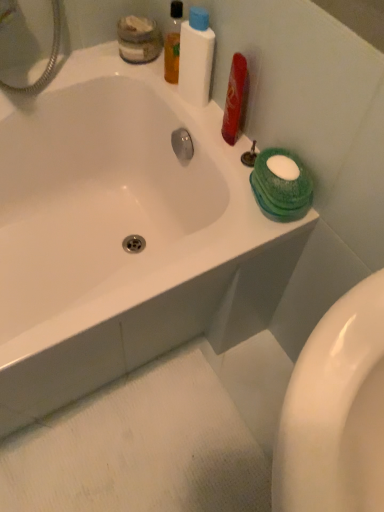
Describe the element at coordinates (138, 39) in the screenshot. Image resolution: width=384 pixels, height=512 pixels. I see `matte glass jar at upper left` at that location.

Locate an element on the screen. white glossy bathtub at upper center is located at coordinates (123, 234).

Find the location of a particular element. Image resolution: width=384 pixels, height=512 pixels. translucent plastic mouthwash at upper center is located at coordinates (173, 42).

Which object is closer to the camera taking this photo, translucent plastic mouthwash at upper center or matte glass jar at upper left?

Positioned in front is translucent plastic mouthwash at upper center.

Is translucent plastic mouthwash at upper center wider or thinner than matte glass jar at upper left?

Clearly, translucent plastic mouthwash at upper center has less width compared to matte glass jar at upper left.

Do you think translucent plastic mouthwash at upper center is within matte glass jar at upper left, or outside of it?

translucent plastic mouthwash at upper center is outside matte glass jar at upper left.

Who is smaller, translucent plastic mouthwash at upper center or matte glass jar at upper left?

translucent plastic mouthwash at upper center is smaller.

Who is taller, white glossy bathtub at upper center or translucent plastic mouthwash at upper center?

With more height is white glossy bathtub at upper center.

Is white glossy bathtub at upper center inside the boundaries of translucent plastic mouthwash at upper center, or outside?

white glossy bathtub at upper center lies outside translucent plastic mouthwash at upper center.

From a real-world perspective, which is physically below, white glossy bathtub at upper center or translucent plastic mouthwash at upper center?

white glossy bathtub at upper center is physically lower.

You are a GUI agent. You are given a task and a screenshot of the screen. Output one action in this format:
    pyautogui.click(x=<x>, y=<y>)
    Task: Click on the mouthwash behind the white glossy bathtub at upper center
    The height and width of the screenshot is (512, 384).
    Given the screenshot: What is the action you would take?
    pyautogui.click(x=173, y=42)

Is matte glass jar at upper left oriented towards white plastic bottle at upper center?

No, matte glass jar at upper left is not oriented towards white plastic bottle at upper center.

Based on the photo, how different are the orientations of matte glass jar at upper left and white plastic bottle at upper center in degrees?

The facing directions of matte glass jar at upper left and white plastic bottle at upper center are 0.000153 degrees apart.

From a real-world perspective, is matte glass jar at upper left located higher than white plastic bottle at upper center?

No, from a real-world perspective, matte glass jar at upper left is not above white plastic bottle at upper center.

From a real-world perspective, between white plastic bottle at upper center and matte glass jar at upper left, who is vertically higher?

In real-world perspective, white plastic bottle at upper center is above.

Is white plastic bottle at upper center next to matte glass jar at upper left?

No, white plastic bottle at upper center is not in contact with matte glass jar at upper left.

The height and width of the screenshot is (512, 384). In order to click on toiletry above the white plastic bottle at upper center (from the image's perspective) in this screenshot , I will do `click(138, 39)`.

Which is correct: white plastic bottle at upper center is inside matte glass jar at upper left, or outside of it?

white plastic bottle at upper center is spatially situated outside matte glass jar at upper left.

From a real-world perspective, is translucent plastic mouthwash at upper center on white plastic bottle at upper center?

Incorrect, from a real-world perspective, translucent plastic mouthwash at upper center is lower than white plastic bottle at upper center.

Is translucent plastic mouthwash at upper center beside white plastic bottle at upper center?

Yes, translucent plastic mouthwash at upper center is beside white plastic bottle at upper center.

Is the depth of translucent plastic mouthwash at upper center less than that of white plastic bottle at upper center?

No, translucent plastic mouthwash at upper center is further to the viewer.

Considering the sizes of objects translucent plastic mouthwash at upper center and white plastic bottle at upper center in the image provided, who is thinner, translucent plastic mouthwash at upper center or white plastic bottle at upper center?

With smaller width is translucent plastic mouthwash at upper center.

Where is `toiletry below the translucent plastic mouthwash at upper center (from a real-world perspective)`? This screenshot has width=384, height=512. toiletry below the translucent plastic mouthwash at upper center (from a real-world perspective) is located at coordinates point(138,39).

From the image's perspective, which object appears higher, matte glass jar at upper left or translucent plastic mouthwash at upper center?

matte glass jar at upper left appears higher in the image.

From a real-world perspective, is matte glass jar at upper left physically below translucent plastic mouthwash at upper center?

Indeed, from a real-world perspective, matte glass jar at upper left is positioned beneath translucent plastic mouthwash at upper center.

Which is correct: matte glass jar at upper left is inside translucent plastic mouthwash at upper center, or outside of it?

matte glass jar at upper left is spatially situated outside translucent plastic mouthwash at upper center.

Which of these two, matte glass jar at upper left or white glossy bathtub at upper center, is thinner?

matte glass jar at upper left.

From a real-world perspective, is matte glass jar at upper left above or below white glossy bathtub at upper center?

In terms of real-world spatial position, matte glass jar at upper left is above white glossy bathtub at upper center.

Is matte glass jar at upper left situated inside white glossy bathtub at upper center or outside?

matte glass jar at upper left is inside white glossy bathtub at upper center.

In order to click on mouthwash located in front of the matte glass jar at upper left in this screenshot , I will do `click(173, 42)`.

Where is `mouthwash above the white glossy bathtub at upper center (from a real-world perspective)`? mouthwash above the white glossy bathtub at upper center (from a real-world perspective) is located at coordinates (173, 42).

Considering their positions, is white glossy bathtub at upper center positioned further to white plastic bottle at upper center than matte glass jar at upper left?

The object further to white plastic bottle at upper center is white glossy bathtub at upper center.

From the image, which object appears to be farther from translucent plastic mouthwash at upper center, white glossy bathtub at upper center or matte glass jar at upper left?

Among the two, white glossy bathtub at upper center is located further to translucent plastic mouthwash at upper center.

Looking at the image, which one is located further to white glossy bathtub at upper center, white plastic bottle at upper center or matte glass jar at upper left?

matte glass jar at upper left is positioned further to the anchor white glossy bathtub at upper center.

Looking at the image, which one is located closer to white plastic bottle at upper center, matte glass jar at upper left or translucent plastic mouthwash at upper center?

Based on the image, translucent plastic mouthwash at upper center appears to be nearer to white plastic bottle at upper center.

When comparing their distances from matte glass jar at upper left, does translucent plastic mouthwash at upper center or white plastic bottle at upper center seem further?

white plastic bottle at upper center lies further to matte glass jar at upper left than the other object.

Based on their spatial positions, is white glossy bathtub at upper center or translucent plastic mouthwash at upper center closer to white plastic bottle at upper center?

Among the two, translucent plastic mouthwash at upper center is located nearer to white plastic bottle at upper center.

When comparing their distances from white plastic bottle at upper center, does translucent plastic mouthwash at upper center or matte glass jar at upper left seem closer?

Among the two, translucent plastic mouthwash at upper center is located nearer to white plastic bottle at upper center.

From the image, which object appears to be nearer to matte glass jar at upper left, translucent plastic mouthwash at upper center or white glossy bathtub at upper center?

translucent plastic mouthwash at upper center lies closer to matte glass jar at upper left than the other object.

This screenshot has width=384, height=512. I want to click on mouthwash between matte glass jar at upper left and white glossy bathtub at upper center in the vertical direction, so click(x=173, y=42).

Find the location of a particular element. The height and width of the screenshot is (512, 384). cleaning product between matte glass jar at upper left and white glossy bathtub at upper center in the up-down direction is located at coordinates (196, 57).

Where is `cleaning product between translucent plastic mouthwash at upper center and white glossy bathtub at upper center vertically`? cleaning product between translucent plastic mouthwash at upper center and white glossy bathtub at upper center vertically is located at coordinates (196, 57).

The height and width of the screenshot is (512, 384). I want to click on mouthwash positioned between white plastic bottle at upper center and matte glass jar at upper left from near to far, so click(x=173, y=42).